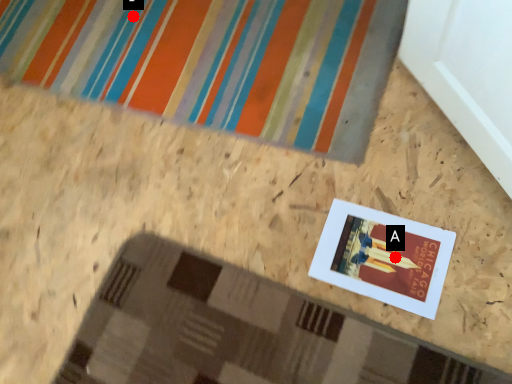
Question: Two points are circled on the image, labeled by A and B beside each circle. Which of the following is the closest to the observer?

Choices:
 (A) A is closer
 (B) B is closer

Answer: (A)